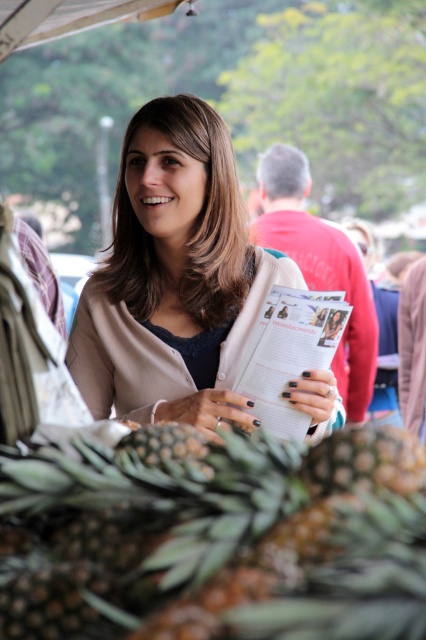
You are a photographer at the market and want to capture both the light beige sweater at center and the white paper magazine at center in a single frame. Based on their sizes, which object will appear larger in the photo?

The light beige sweater at center is much taller than the white paper magazine at center, so it will appear larger in the photo.

You are at a market stall and see both the brown rough pineapple at lower center and the white paper magazine at center. Which item is positioned to the left?

The brown rough pineapple at lower center is positioned to the left of the white paper magazine at center.

In the scene shown: You are a customer at the market and want to buy the brown rough pineapple at lower center. The market has a rule that items must be placed exactly at coordinate point 0.841, 0.505 to be sold. Is the pineapple correctly positioned according to the market rules?

Yes, the brown rough pineapple at lower center is correctly positioned because its 2D location is at point [215,538] as required by the market rules.